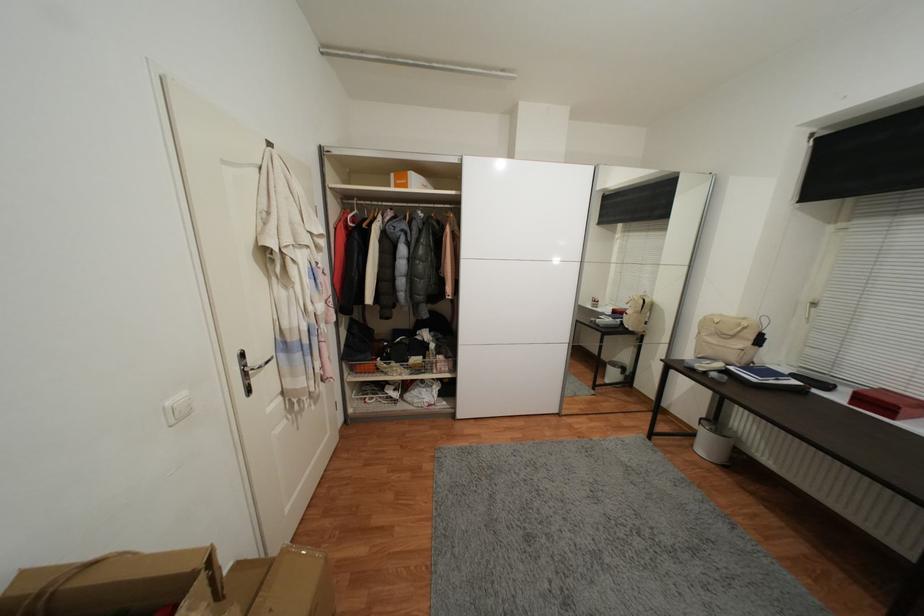
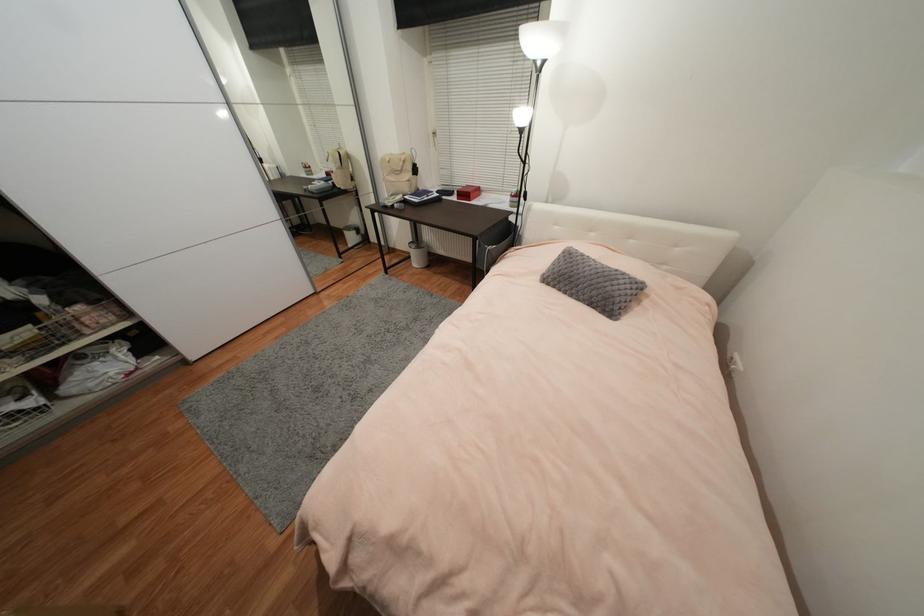
Based on the continuous images, in which direction is the camera rotating?

The rotation direction of the camera is right-down.